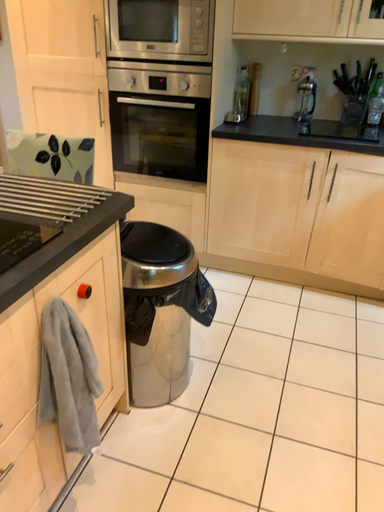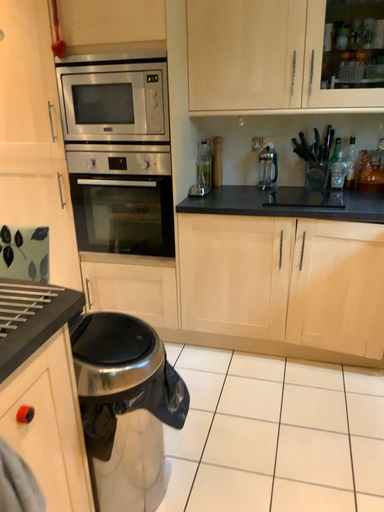
Question: How did the camera likely rotate when shooting the video?

Choices:
 (A) rotated upward
 (B) rotated downward

Answer: (A)